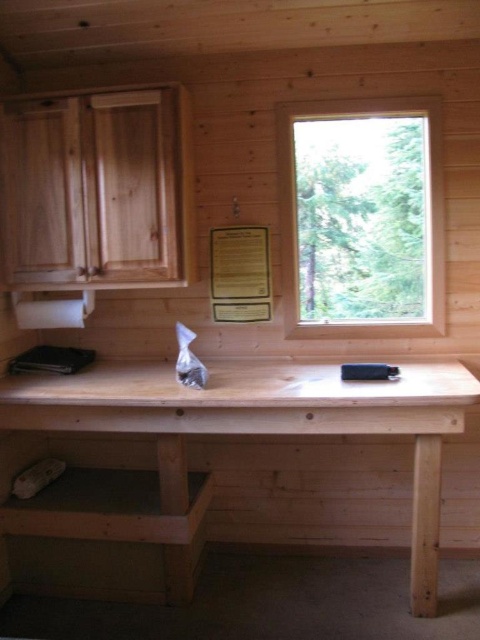
You are sitting at the natural wood table at center in a rustic cabin. You want to look outside through the clear glass window at upper right. In which direction should you turn your head to see the window?

The natural wood table at center is positioned on the left side of the clear glass window at upper right, so you should turn your head to the right to see the window.

You are inside the rustic wooden cabin and want to place a potted plant on the table so that it can receive sunlight from the window. Based on the scene description, where should you position the potted plant on the natural wood table at center to ensure it gets sunlight from the clear glass window at upper right?

The natural wood table at center is located below the clear glass window at upper right, so positioning the potted plant near the edge of the natural wood table at center closest to the clear glass window at upper right would ensure it receives sunlight from the window.